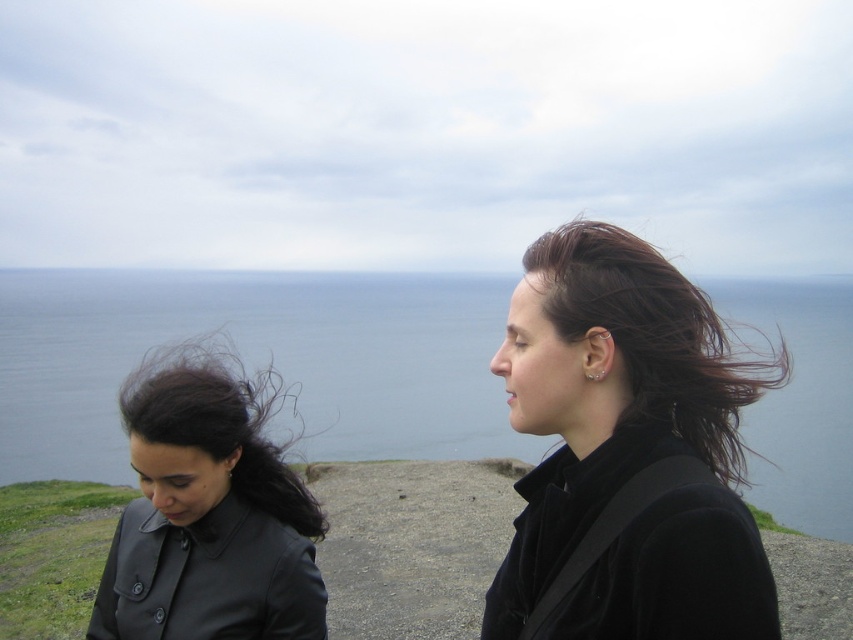
Does point (35, 432) come behind point (613, 356)?

That is True.

Can you confirm if blue water at center is positioned above black velvet jacket at upper right?

Indeed, blue water at center is positioned over black velvet jacket at upper right.

This screenshot has height=640, width=853. What do you see at coordinates (256, 360) in the screenshot?
I see `blue water at center` at bounding box center [256, 360].

Find the location of `blue water at center`. blue water at center is located at coordinates (256, 360).

Can you confirm if blue water at center is positioned to the left of matte black jacket at left?

In fact, blue water at center is to the right of matte black jacket at left.

Between blue water at center and matte black jacket at left, which one is positioned higher?

blue water at center

Image resolution: width=853 pixels, height=640 pixels. In order to click on blue water at center in this screenshot , I will do `click(256, 360)`.

Between black velvet jacket at upper right and matte black jacket at left, which one is positioned lower?

matte black jacket at left is lower down.

Locate an element on the screen. The image size is (853, 640). black velvet jacket at upper right is located at coordinates (628, 449).